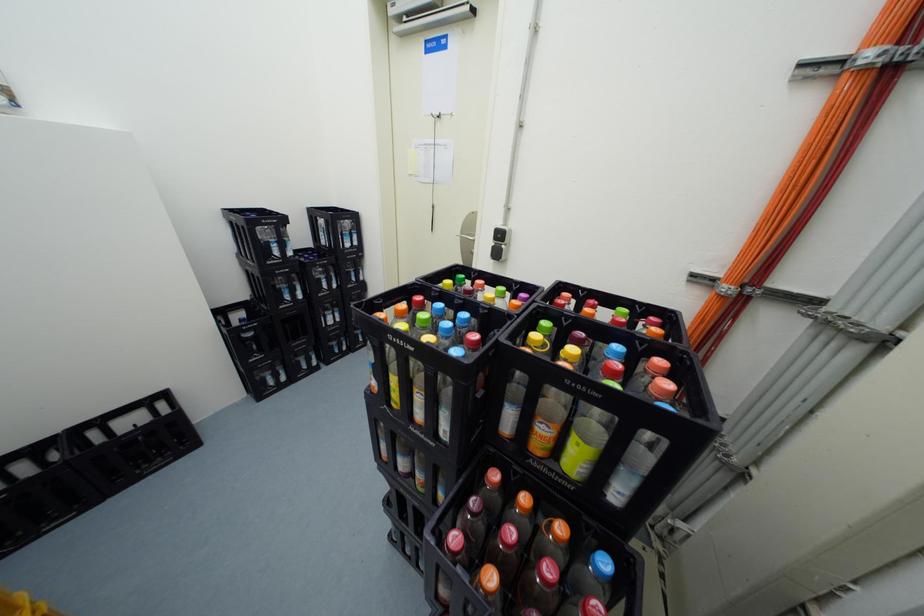
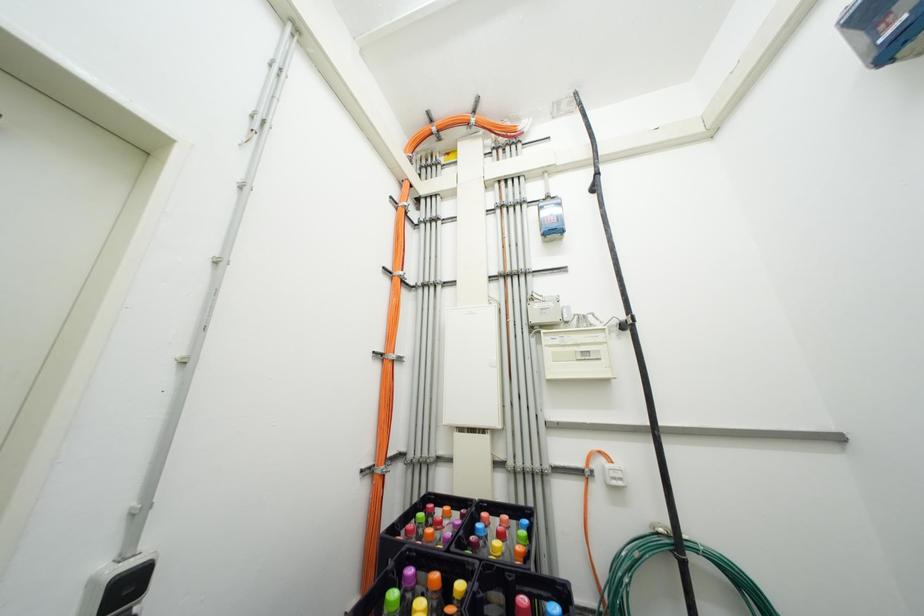
Question: How did the camera likely rotate?

Choices:
 (A) Left
 (B) Right
 (C) Up
 (D) Down

Answer: (B)